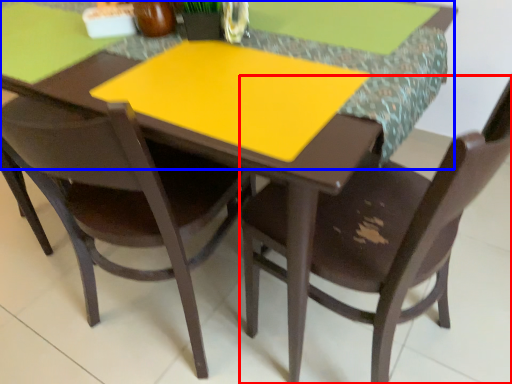
Question: Which object appears farthest to the camera in this image, chair (highlighted by a red box) or counter top (highlighted by a blue box)?

Choices:
 (A) chair
 (B) counter top

Answer: (B)